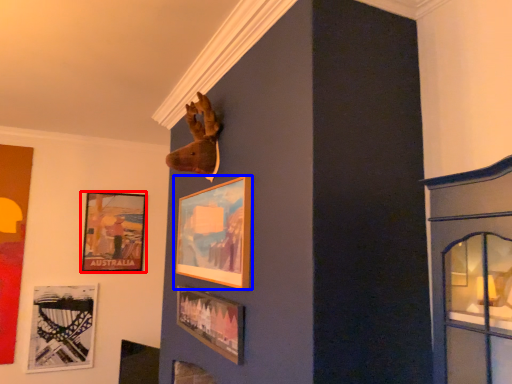
Question: Which object appears closest to the camera in this image, picture frame (highlighted by a red box) or picture frame (highlighted by a blue box)?

Choices:
 (A) picture frame
 (B) picture frame

Answer: (B)